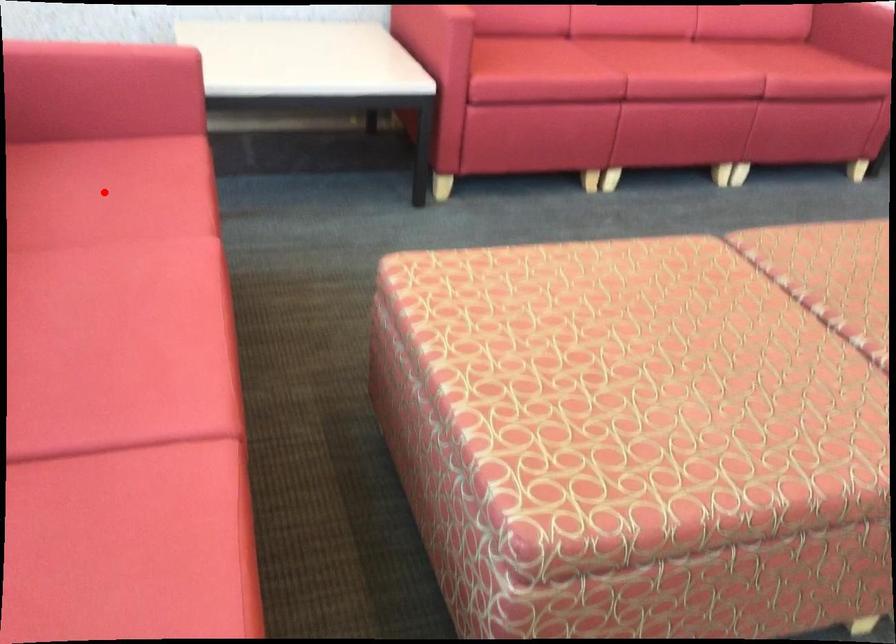
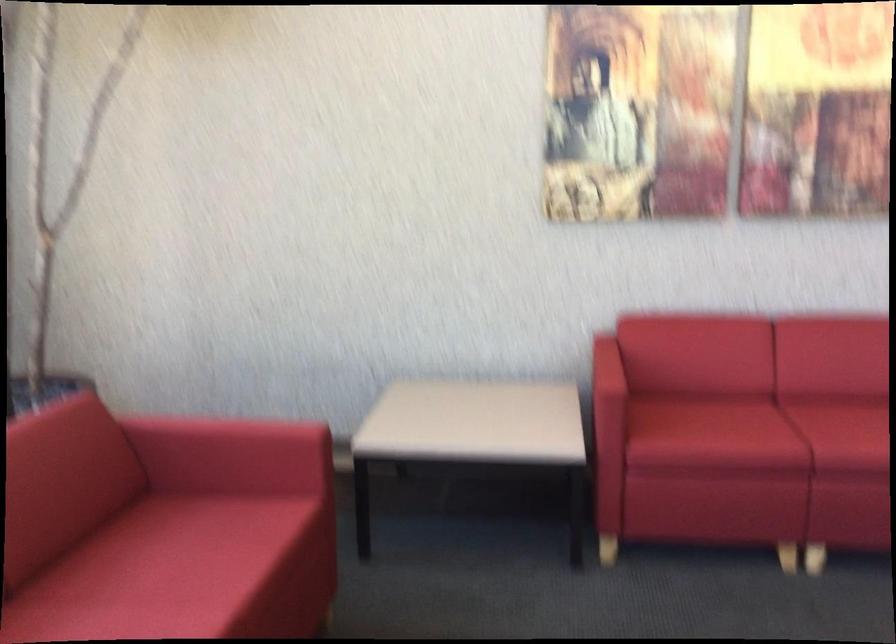
Question: A red point is marked in image1. In image2, is the corresponding 3D point closer to the camera or farther? Reply with the corresponding letter.

Choices:
 (A) The corresponding 3D point is closer.
 (B) The corresponding 3D point is farther.

Answer: (B)